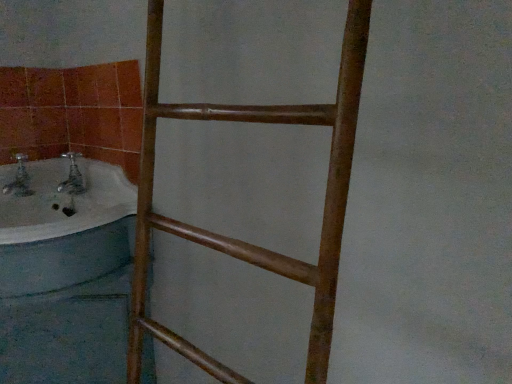
This screenshot has height=384, width=512. What do you see at coordinates (239, 240) in the screenshot?
I see `brown wooden ladder at center` at bounding box center [239, 240].

Where is `brown wooden ladder at center`? Image resolution: width=512 pixels, height=384 pixels. brown wooden ladder at center is located at coordinates (239, 240).

Identify the location of white glossy bathtub at left. (64, 227).

The height and width of the screenshot is (384, 512). What do you see at coordinates (64, 227) in the screenshot?
I see `white glossy bathtub at left` at bounding box center [64, 227].

This screenshot has width=512, height=384. In order to click on brown wooden ladder at center in this screenshot , I will do `click(239, 240)`.

Is white glossy bathtub at left at the right side of brown wooden ladder at center?

In fact, white glossy bathtub at left is to the left of brown wooden ladder at center.

Is the position of white glossy bathtub at left less distant than that of brown wooden ladder at center?

No, white glossy bathtub at left is behind brown wooden ladder at center.

Considering the points (78, 268) and (354, 2), which point is behind, point (78, 268) or point (354, 2)?

Positioned behind is point (78, 268).

From the image's perspective, is white glossy bathtub at left located beneath brown wooden ladder at center?

No, from the image's perspective, white glossy bathtub at left is not below brown wooden ladder at center.

From a real-world perspective, is white glossy bathtub at left over brown wooden ladder at center?

No, from a real-world perspective, white glossy bathtub at left is not above brown wooden ladder at center.

Is white glossy bathtub at left wider than brown wooden ladder at center?

Correct, the width of white glossy bathtub at left exceeds that of brown wooden ladder at center.

Is white glossy bathtub at left taller than brown wooden ladder at center?

In fact, white glossy bathtub at left may be shorter than brown wooden ladder at center.

Does white glossy bathtub at left have a larger size compared to brown wooden ladder at center?

Incorrect, white glossy bathtub at left is not larger than brown wooden ladder at center.

Is white glossy bathtub at left not within brown wooden ladder at center?

white glossy bathtub at left lies outside brown wooden ladder at center's area.

Is white glossy bathtub at left not near brown wooden ladder at center?

No, white glossy bathtub at left is in close proximity to brown wooden ladder at center.

Is brown wooden ladder at center at the back of white glossy bathtub at left?

No, white glossy bathtub at left is not facing away from brown wooden ladder at center.

Where is `bathtub on the left of brown wooden ladder at center`? bathtub on the left of brown wooden ladder at center is located at coordinates (64, 227).

Which object is positioned more to the right, brown wooden ladder at center or white glossy bathtub at left?

brown wooden ladder at center.

Does brown wooden ladder at center come in front of white glossy bathtub at left?

Yes, the depth of brown wooden ladder at center is less than that of white glossy bathtub at left.

Does point (197, 358) lie in front of point (30, 176)?

Yes, point (197, 358) is in front of point (30, 176).

From the image's perspective, is brown wooden ladder at center located beneath white glossy bathtub at left?

Indeed, from the image's perspective, brown wooden ladder at center is shown beneath white glossy bathtub at left.

From a real-world perspective, between brown wooden ladder at center and white glossy bathtub at left, who is vertically lower?

white glossy bathtub at left is physically lower.

Looking at their sizes, would you say brown wooden ladder at center is wider or thinner than white glossy bathtub at left?

Considering their sizes, brown wooden ladder at center looks slimmer than white glossy bathtub at left.

Can you confirm if brown wooden ladder at center is shorter than white glossy bathtub at left?

No.

Is brown wooden ladder at center bigger or smaller than white glossy bathtub at left?

In the image, brown wooden ladder at center appears to be larger than white glossy bathtub at left.

Can we say brown wooden ladder at center lies outside white glossy bathtub at left?

brown wooden ladder at center lies outside white glossy bathtub at left's area.

Is brown wooden ladder at center not close to white glossy bathtub at left?

brown wooden ladder at center is actually quite close to white glossy bathtub at left.

Is brown wooden ladder at center facing towards white glossy bathtub at left?

No, brown wooden ladder at center is not oriented towards white glossy bathtub at left.

How many degrees apart are the facing directions of brown wooden ladder at center and white glossy bathtub at left?

The facing directions of brown wooden ladder at center and white glossy bathtub at left are 0.00374 degrees apart.

How much distance is there between brown wooden ladder at center and white glossy bathtub at left?

A distance of 12.56 inches exists between brown wooden ladder at center and white glossy bathtub at left.

The height and width of the screenshot is (384, 512). What are the coordinates of `bathtub on the left of brown wooden ladder at center` in the screenshot? It's located at (64, 227).

You are a GUI agent. You are given a task and a screenshot of the screen. Output one action in this format:
    pyautogui.click(x=<x>, y=<y>)
    Task: Click on the bathtub that is above the brown wooden ladder at center (from the image's perspective)
    The height and width of the screenshot is (384, 512).
    Given the screenshot: What is the action you would take?
    pyautogui.click(x=64, y=227)

Identify the location of ladder in front of the white glossy bathtub at left. Image resolution: width=512 pixels, height=384 pixels. (239, 240).